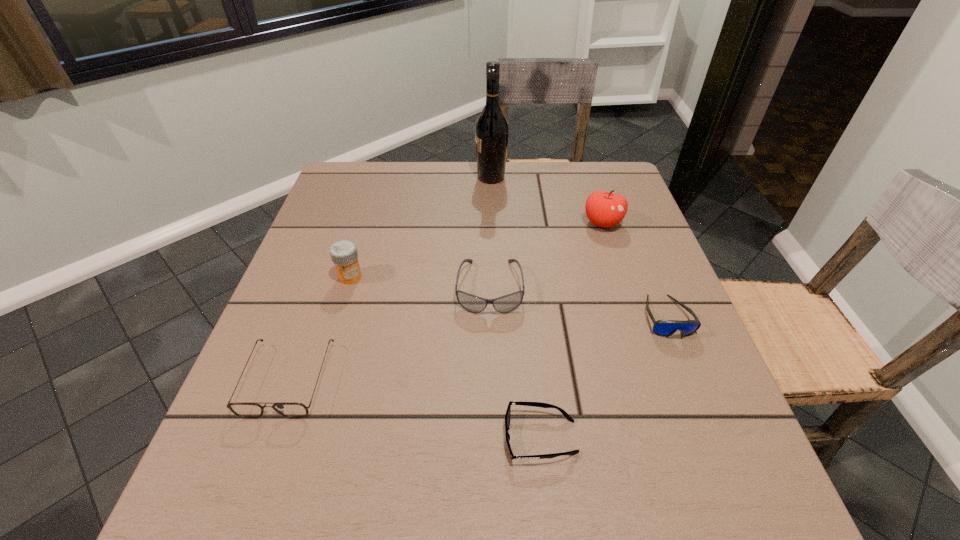
At what (x,y) coordinates should I click in order to perform the action: click on free space located 0.380m on the label of the tallest object. Please return your answer as a coordinate pair (x, y). The image size is (960, 540). Looking at the image, I should click on (343, 177).

Locate an element on the screen. This screenshot has height=540, width=960. free space located 0.240m on the back of the second farthest object is located at coordinates (584, 165).

The image size is (960, 540). Identify the location of free space located 0.360m on the label side of the medicine. (299, 448).

Locate an element on the screen. The width and height of the screenshot is (960, 540). vacant space located on the front-facing side of the rightmost sunglasses is located at coordinates (692, 381).

Image resolution: width=960 pixels, height=540 pixels. Find the location of `vacant area located on the front-facing side of the leftmost sunglasses`. vacant area located on the front-facing side of the leftmost sunglasses is located at coordinates (252, 481).

You are a GUI agent. You are given a task and a screenshot of the screen. Output one action in this format:
    pyautogui.click(x=<x>, y=<y>)
    Task: Click on the vacant region located on the front-facing side of the shortest object
    Image resolution: width=960 pixels, height=540 pixels.
    Given the screenshot: What is the action you would take?
    pyautogui.click(x=273, y=437)

Locate an element on the screen. This screenshot has height=540, width=960. free space located 0.180m on the front-facing side of the shortest object is located at coordinates [x=392, y=437].

Locate an element on the screen. The width and height of the screenshot is (960, 540). vacant space situated 0.100m on the front-facing side of the shortest object is located at coordinates (442, 437).

Locate an element on the screen. This screenshot has height=540, width=960. object positioned at the far edge is located at coordinates (491, 128).

The width and height of the screenshot is (960, 540). Identify the location of medicine positioned at the left edge. (344, 254).